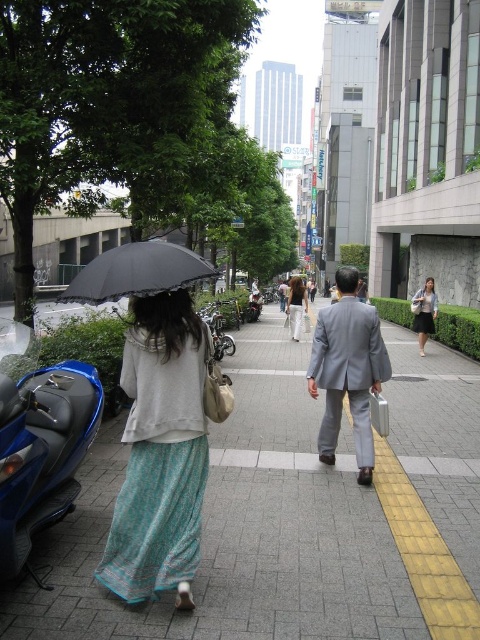
You are a pedestrian trying to cross the street and need to avoid both the matte gray skirt at center and the shiny chrome motorcycle at center. Which object should you move away from first based on their sizes?

The matte gray skirt at center has a larger width than the shiny chrome motorcycle at center, so you should move away from the matte gray skirt at center first since it occupies more space.

You are standing on the gray concrete sidewalk at center and want to place a small potted plant on the light blue textured skirt at left. Considering their heights, will the plant be visible from above?

The gray concrete sidewalk at center has a lesser height compared to light blue textured skirt at left, so the potted plant placed on the light blue textured skirt at left will be higher up and thus more visible from above.

Where is the black lace umbrella at center located in the image?

The black lace umbrella at center is located at point (136, 273) in the image.